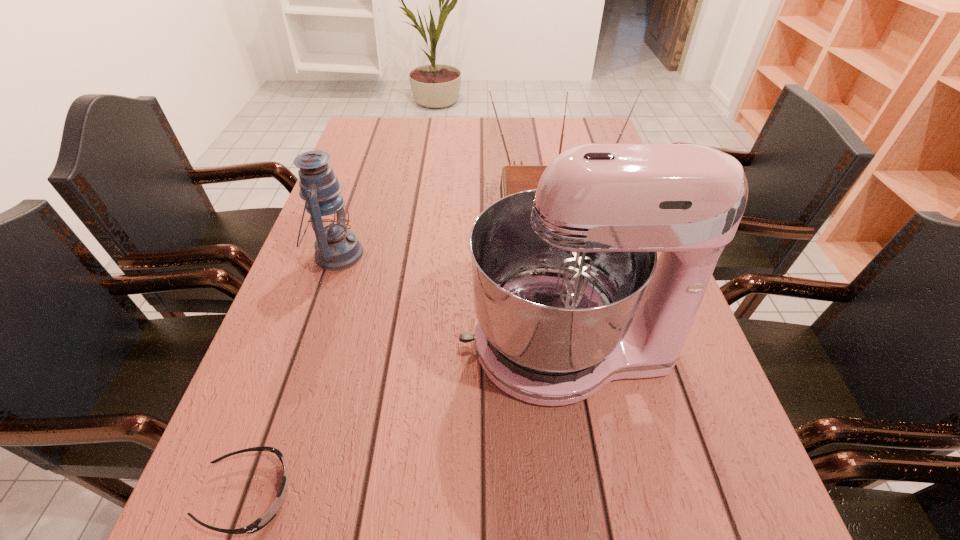
Where is `vacant space at the far left corner of the desktop`? Image resolution: width=960 pixels, height=540 pixels. vacant space at the far left corner of the desktop is located at coordinates (366, 117).

Where is `free spot at the far right corner of the desktop`? This screenshot has width=960, height=540. free spot at the far right corner of the desktop is located at coordinates (572, 132).

Where is `vacant space that's between the sunglasses and the radio_receiver`? The image size is (960, 540). vacant space that's between the sunglasses and the radio_receiver is located at coordinates (400, 346).

Where is `free space between the shortest object and the lantern`? free space between the shortest object and the lantern is located at coordinates (293, 375).

Image resolution: width=960 pixels, height=540 pixels. Identify the location of vacant space that is in between the lantern and the mixer. (452, 300).

Find the location of a particular element. The image size is (960, 540). vacant region between the tallest object and the lantern is located at coordinates (452, 300).

You are a GUI agent. You are given a task and a screenshot of the screen. Output one action in this format:
    pyautogui.click(x=<x>, y=<y>)
    Task: Click on the unoccupied position between the tallest object and the shortest object
    
    Given the screenshot: What is the action you would take?
    pyautogui.click(x=408, y=420)

Where is `vacant space in between the radio_receiver and the lantern`? The image size is (960, 540). vacant space in between the radio_receiver and the lantern is located at coordinates (444, 226).

You are a GUI agent. You are given a task and a screenshot of the screen. Output one action in this format:
    pyautogui.click(x=<x>, y=<y>)
    Task: Click on the vacant space that is in between the radio_receiver and the lantern
    
    Given the screenshot: What is the action you would take?
    pyautogui.click(x=444, y=226)

The height and width of the screenshot is (540, 960). In order to click on empty space between the nearest object and the radio_receiver in this screenshot , I will do `click(400, 346)`.